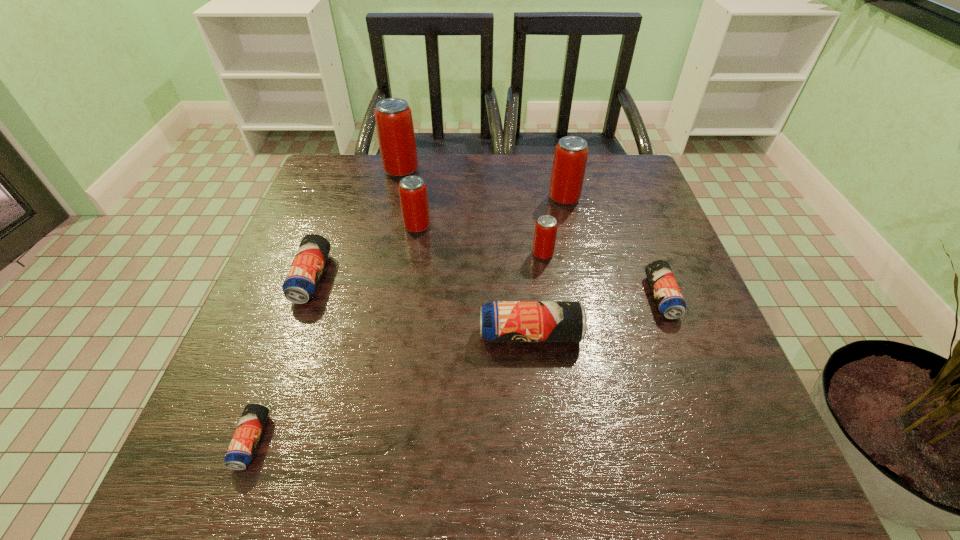
Locate an element on the screen. The height and width of the screenshot is (540, 960). the farthest pink beer can is located at coordinates (393, 116).

Find the location of `the biggest pink beer can`. the biggest pink beer can is located at coordinates (393, 116).

At what (x,y) coordinates should I click in order to perform the action: click on the second tallest object. Please return your answer as a coordinate pair (x, y). This screenshot has width=960, height=540. Looking at the image, I should click on (570, 158).

The width and height of the screenshot is (960, 540). I want to click on the seventh nearest object, so click(x=570, y=158).

Identify the location of the third farthest object. The height and width of the screenshot is (540, 960). (413, 195).

Where is `the third farthest beer can`? The image size is (960, 540). the third farthest beer can is located at coordinates (413, 195).

This screenshot has width=960, height=540. Find the location of `the fourth tallest object`. the fourth tallest object is located at coordinates (545, 233).

This screenshot has width=960, height=540. I want to click on the nearest pink beer can, so click(545, 233).

Locate an element on the screen. the third blue beer can from left to right is located at coordinates (500, 321).

Locate an element on the screen. the fourth shortest beer can is located at coordinates (500, 321).